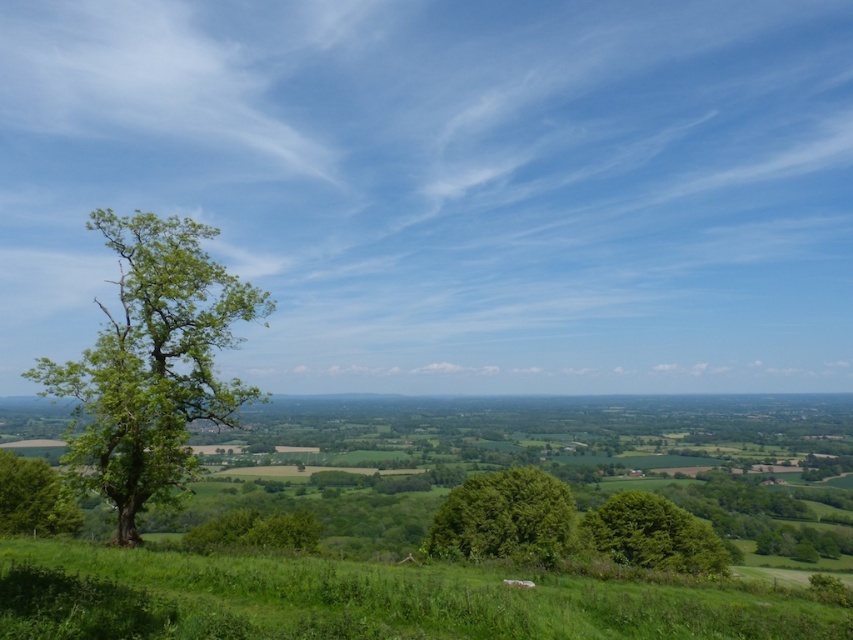
You are standing at the point with coordinates point (15, 528) and want to walk towards the tree on the left side. Will the point (190, 243) block your path?

Point (190, 243) is in front of point (15, 528), so yes, the point (190, 243) will block your path when walking towards the tree on the left side.

You are standing in the middle of the field and see the green leafy tree at left and the green leafy tree at lower left. Which tree is closer to you?

The green leafy tree at lower left is closer to you because it is positioned under the green leafy tree at left, meaning it is in a lower, nearer position.